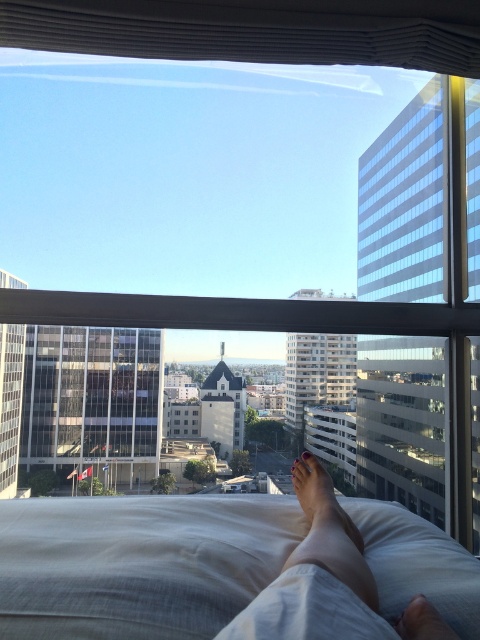
Question: Is pink matte nail polish at lower center above smooth skin foot at lower center?

Choices:
 (A) yes
 (B) no

Answer: (B)

Question: Which object is positioned closest to the pink matte foot at lower center?

Choices:
 (A) white soft pillow at lower center
 (B) pink matte nail polish at lower center
 (C) smooth skin foot at lower center
 (D) skinny white legs at lower center

Answer: (A)

Question: In this image, where is skinny white legs at lower center located relative to pink matte nail polish at lower center?

Choices:
 (A) left
 (B) right

Answer: (A)

Question: Considering the real-world distances, which object is closest to the smooth skin foot at lower center?

Choices:
 (A) skinny white legs at lower center
 (B) pink matte nail polish at lower center

Answer: (A)

Question: Which of the following is the closest to the observer?

Choices:
 (A) (180, 595)
 (B) (297, 460)

Answer: (A)

Question: Does pink matte foot at lower center appear over smooth skin foot at lower center?

Choices:
 (A) no
 (B) yes

Answer: (A)